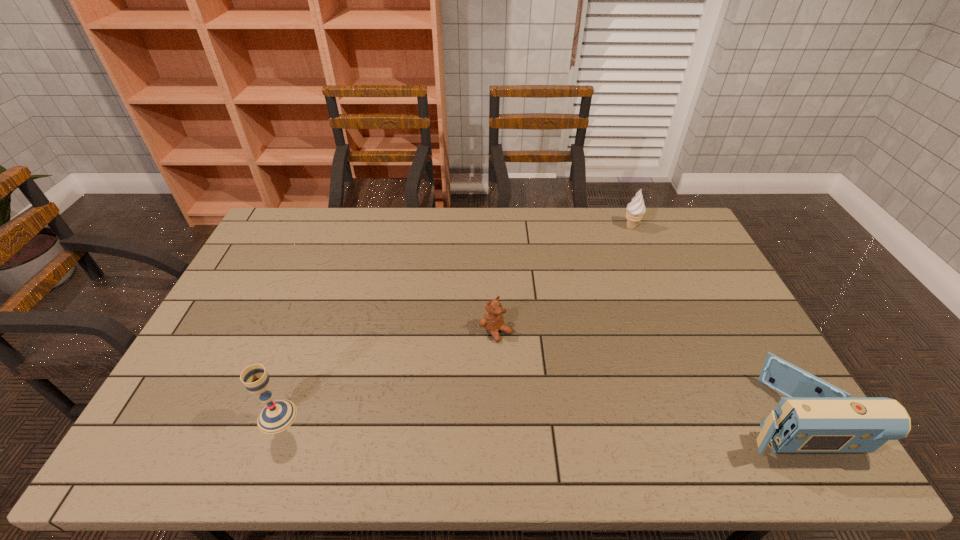
In order to click on free space on the desktop that is between the chalice and the rightmost object and is positioned on the face of the shortest object in this screenshot , I will do `click(589, 416)`.

Image resolution: width=960 pixels, height=540 pixels. Identify the location of free spot on the desktop that is between the leftmost object and the camcorder and is positioned on the front-facing side of the third object from left to right. (583, 416).